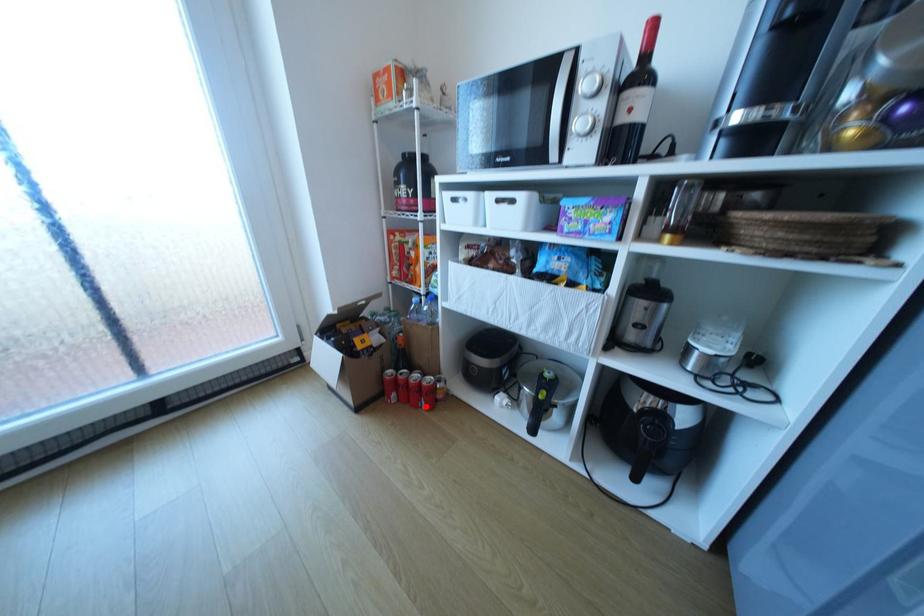
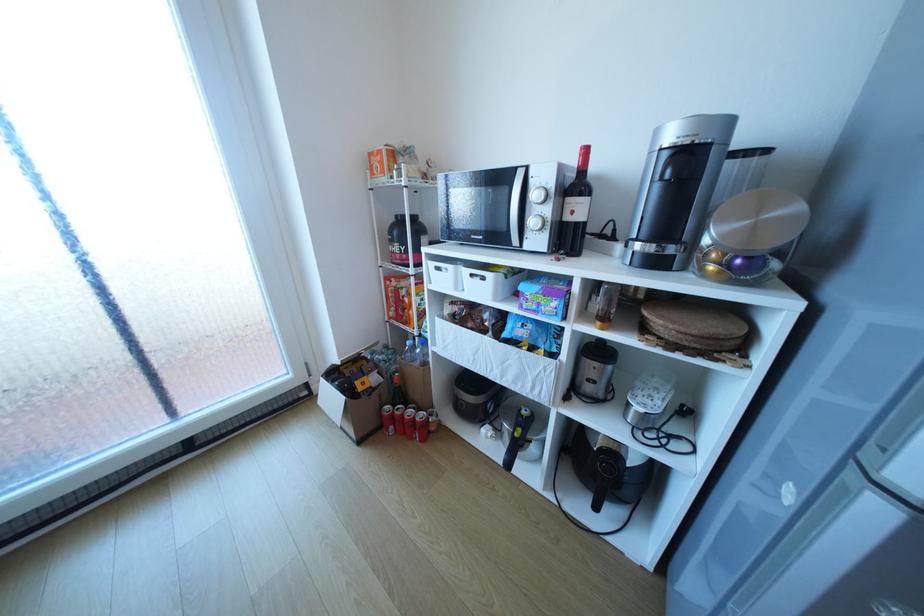
Question: A red point is marked in image1. In image2, is the corresponding 3D point closer to the camera or farther? Reply with the corresponding letter.

Choices:
 (A) The corresponding 3D point is closer.
 (B) The corresponding 3D point is farther.

Answer: (A)